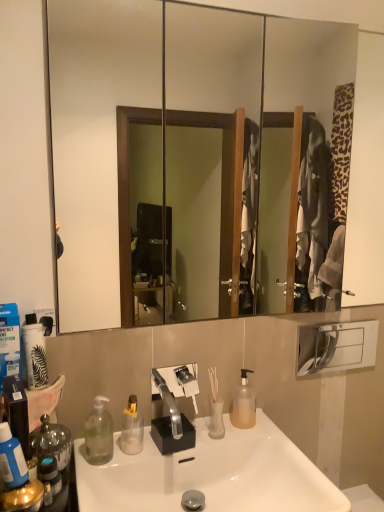
The image size is (384, 512). What do you see at coordinates (132, 428) in the screenshot?
I see `transparent plastic bottle at sink, placed as the 2th bottle when sorted from back to front` at bounding box center [132, 428].

This screenshot has width=384, height=512. Describe the element at coordinates (99, 433) in the screenshot. I see `clear plastic bottle at lower left, which appears as the third bottle when viewed from the right` at that location.

Where is `white matte toilet paper at lower left`? This screenshot has height=512, width=384. white matte toilet paper at lower left is located at coordinates (35, 356).

Between clear glass vase at center and clear glass mirror at upper center, which one appears on the left side from the viewer's perspective?

Positioned to the left is clear glass vase at center.

From a real-world perspective, is clear glass vase at center physically located above or below clear glass mirror at upper center?

clear glass vase at center is below clear glass mirror at upper center.

Does point (216, 408) come behind point (276, 66)?

No, (216, 408) is in front of (276, 66).

Which is farther from the camera, (12, 447) or (38, 345)?

Positioned behind is point (38, 345).

Consider the image. Is blue matte bottle at left, arranged as the fourth bottle when viewed from the back, to the left of white matte toilet paper at lower left from the viewer's perspective?

No.

Measure the distance between blue matte bottle at left, arranged as the fourth bottle when viewed from the back, and white matte toilet paper at lower left.

blue matte bottle at left, arranged as the fourth bottle when viewed from the back, is 8.73 inches from white matte toilet paper at lower left.

Can you tell me how much blue matte bottle at left, arranged as the fourth bottle when viewed from the back, and white matte toilet paper at lower left differ in facing direction?

There is a 0.00116-degree angle between the facing directions of blue matte bottle at left, arranged as the fourth bottle when viewed from the back, and white matte toilet paper at lower left.

From a real-world perspective, is white matte toilet paper at lower left on white glossy sink at center?

Yes, from a real-world perspective, white matte toilet paper at lower left is above white glossy sink at center.

From the image's perspective, which is below, white matte toilet paper at lower left or white glossy sink at center?

white glossy sink at center appears lower in the image.

Is white matte toilet paper at lower left completely or partially outside of white glossy sink at center?

Absolutely, white matte toilet paper at lower left is external to white glossy sink at center.

Considering the sizes of objects white matte toilet paper at lower left and white glossy sink at center in the image provided, who is wider, white matte toilet paper at lower left or white glossy sink at center?

white glossy sink at center is wider.

Which object is positioned more to the right, white glossy sink at center or blue matte bottle at left, which is the 1th bottle from left to right?

white glossy sink at center.

Where is `sink in front of the blue matte bottle at left, acting as the 4th bottle starting from the right`? The height and width of the screenshot is (512, 384). sink in front of the blue matte bottle at left, acting as the 4th bottle starting from the right is located at coordinates (210, 474).

From a real-world perspective, is white glossy sink at center physically below blue matte bottle at left, which is the 1th bottle from left to right?

Yes, from a real-world perspective, white glossy sink at center is below blue matte bottle at left, which is the 1th bottle from left to right.

Do you think white glossy sink at center is within blue matte bottle at left, which is the 1th bottle from front to back, or outside of it?

white glossy sink at center is not enclosed by blue matte bottle at left, which is the 1th bottle from front to back.

Can you tell me how much white glossy sink at center and transparent plastic bottle at sink, positioned as the second bottle in right-to-left order, differ in facing direction?

The facing directions of white glossy sink at center and transparent plastic bottle at sink, positioned as the second bottle in right-to-left order, are 0.000991 degrees apart.

This screenshot has height=512, width=384. In order to click on sink that is on the right side of transparent plastic bottle at sink, the third bottle in the left-to-right sequence in this screenshot , I will do `click(210, 474)`.

From a real-world perspective, does white glossy sink at center sit lower than transparent plastic bottle at sink, positioned as the second bottle in right-to-left order?

Yes, from a real-world perspective, white glossy sink at center is beneath transparent plastic bottle at sink, positioned as the second bottle in right-to-left order.

Which is more to the right, white glossy sink at center or transparent plastic bottle at sink, which is the 3th bottle from front to back?

white glossy sink at center.

From a real-world perspective, who is located lower, white matte toilet paper at lower left or translucent plastic pump bottle at center, the 4th bottle in the front-to-back sequence?

translucent plastic pump bottle at center, the 4th bottle in the front-to-back sequence, is physically lower.

Where is `the 3rd bottle behind when counting from the white matte toilet paper at lower left`? This screenshot has width=384, height=512. the 3rd bottle behind when counting from the white matte toilet paper at lower left is located at coordinates (243, 404).

Is white matte toilet paper at lower left turned away from translucent plastic pump bottle at center, the 4th bottle in the front-to-back sequence?

white matte toilet paper at lower left does not have its back to translucent plastic pump bottle at center, the 4th bottle in the front-to-back sequence.

Consider the image. In terms of width, does white matte toilet paper at lower left look wider or thinner when compared to translucent plastic pump bottle at center, arranged as the fourth bottle when viewed from the left?

In the image, white matte toilet paper at lower left appears to be wider than translucent plastic pump bottle at center, arranged as the fourth bottle when viewed from the left.

Is translucent plastic pump bottle at center, which is the 1th bottle from right to left, completely or partially inside clear plastic bottle at lower left, which is counted as the third bottle, starting from the back?

That's incorrect, translucent plastic pump bottle at center, which is the 1th bottle from right to left, is not inside clear plastic bottle at lower left, which is counted as the third bottle, starting from the back.

Consider the image. Is clear plastic bottle at lower left, which appears as the third bottle when viewed from the right, facing towards translucent plastic pump bottle at center, the 1th bottle from the back?

No, clear plastic bottle at lower left, which appears as the third bottle when viewed from the right, does not turn towards translucent plastic pump bottle at center, the 1th bottle from the back.

Relative to translucent plastic pump bottle at center, which is the 1th bottle from right to left, is clear plastic bottle at lower left, the second bottle positioned from the front, in front or behind?

Clearly, clear plastic bottle at lower left, the second bottle positioned from the front, is in front of translucent plastic pump bottle at center, which is the 1th bottle from right to left.

Where is `toiletry behind the clear glass mirror at upper center`? toiletry behind the clear glass mirror at upper center is located at coordinates (216, 408).

Find the location of a particular element. bottle lying in front of the white matte toilet paper at lower left is located at coordinates (12, 459).

Which object lies further to the anchor point clear plastic bottle at lower left, arranged as the 2th bottle when viewed from the left, white glossy sink at center or clear glass vase at center?

The object further to clear plastic bottle at lower left, arranged as the 2th bottle when viewed from the left, is clear glass vase at center.

Based on their spatial positions, is clear glass vase at center or transparent plastic bottle at sink, which is the 3th bottle from front to back, closer to blue matte bottle at left, which is the 1th bottle from front to back?

The object closer to blue matte bottle at left, which is the 1th bottle from front to back, is transparent plastic bottle at sink, which is the 3th bottle from front to back.

Which object lies further to the anchor point translucent plastic pump bottle at center, arranged as the fourth bottle when viewed from the left, white matte toilet paper at lower left or white glossy sink at center?

white matte toilet paper at lower left.

Based on their spatial positions, is blue matte bottle at left, acting as the 4th bottle starting from the right, or transparent plastic bottle at sink, positioned as the second bottle in right-to-left order, further from white glossy sink at center?

blue matte bottle at left, acting as the 4th bottle starting from the right, is positioned further to the anchor white glossy sink at center.

Looking at the image, which one is located closer to clear glass vase at center, translucent plastic pump bottle at center, the 4th bottle in the front-to-back sequence, or white glossy sink at center?

translucent plastic pump bottle at center, the 4th bottle in the front-to-back sequence, is closer to clear glass vase at center.

Which object lies further to the anchor point clear glass vase at center, white matte toilet paper at lower left or blue matte bottle at left, which is the 1th bottle from left to right?

The object further to clear glass vase at center is blue matte bottle at left, which is the 1th bottle from left to right.

Looking at the image, which one is located further to clear glass vase at center, clear glass mirror at upper center or white glossy sink at center?

clear glass mirror at upper center.

Estimate the real-world distances between objects in this image. Which object is further from clear glass mirror at upper center, white matte toilet paper at lower left or white glossy sink at center?

white matte toilet paper at lower left is positioned further to the anchor clear glass mirror at upper center.

At what (x,y) coordinates should I click in order to perform the action: click on sink between white matte toilet paper at lower left and translucent plastic pump bottle at center, arranged as the fourth bottle when viewed from the left. Please return your answer as a coordinate pair (x, y). Looking at the image, I should click on (210, 474).

What are the coordinates of `toilet paper between clear glass mirror at upper center and blue matte bottle at left, arranged as the fourth bottle when viewed from the back, in the vertical direction` in the screenshot? It's located at (35, 356).

Identify the location of toilet paper between blue matte bottle at left, which is the 1th bottle from front to back, and clear plastic bottle at lower left, the second bottle positioned from the front, from front to back. Image resolution: width=384 pixels, height=512 pixels. [x=35, y=356].

Where is `toilet paper between clear glass mirror at upper center and clear glass vase at center from top to bottom`? toilet paper between clear glass mirror at upper center and clear glass vase at center from top to bottom is located at coordinates (35, 356).